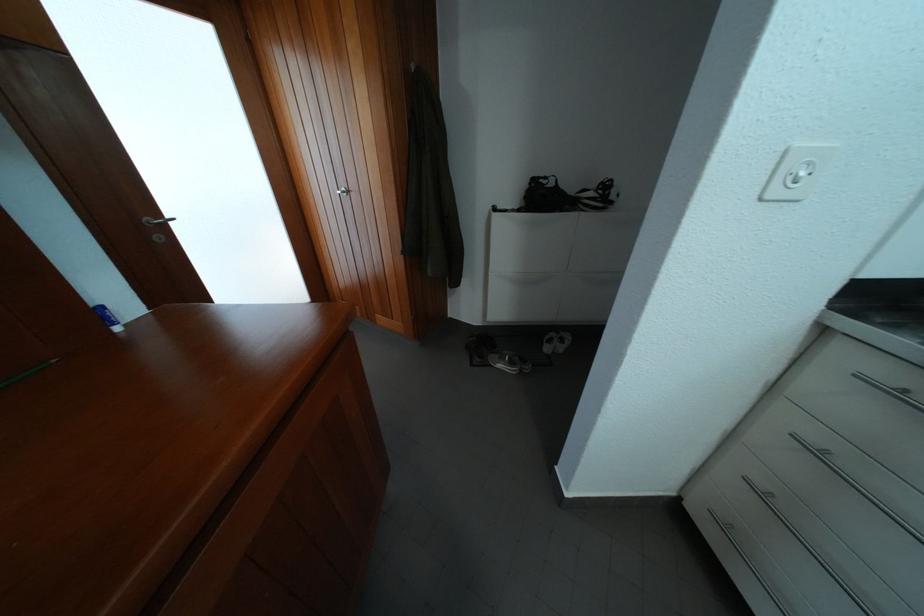
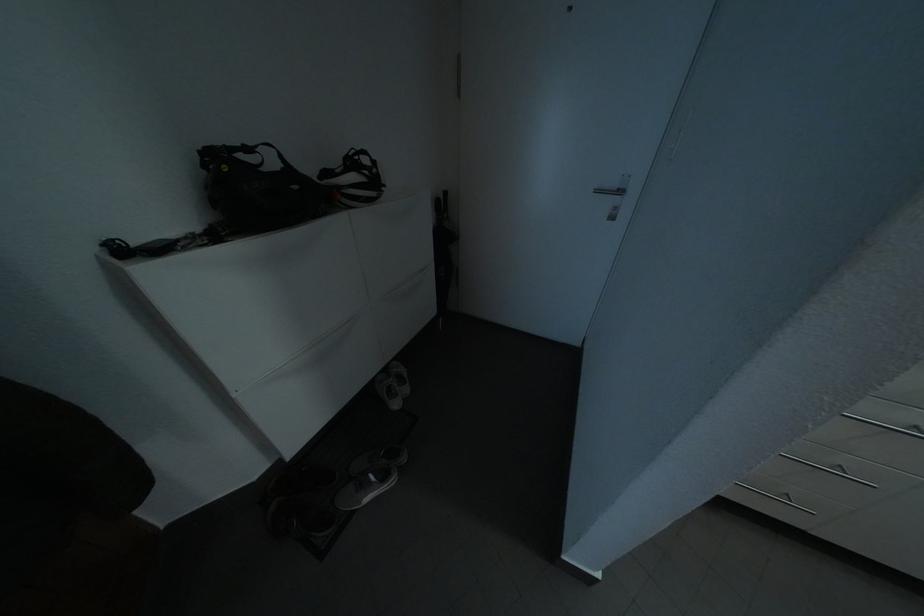
The point at (589, 204) is marked in the first image. Where is the corresponding point in the second image?

(348, 193)